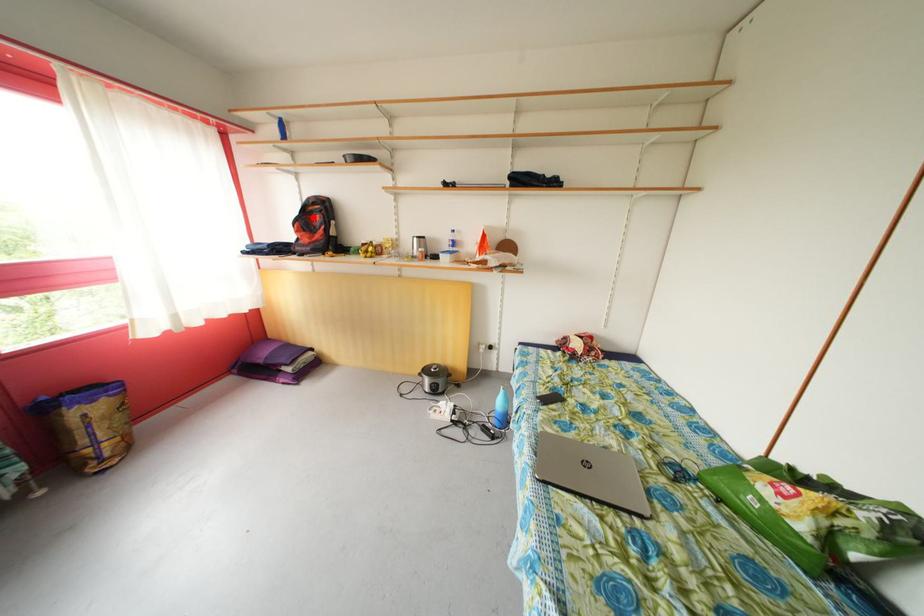
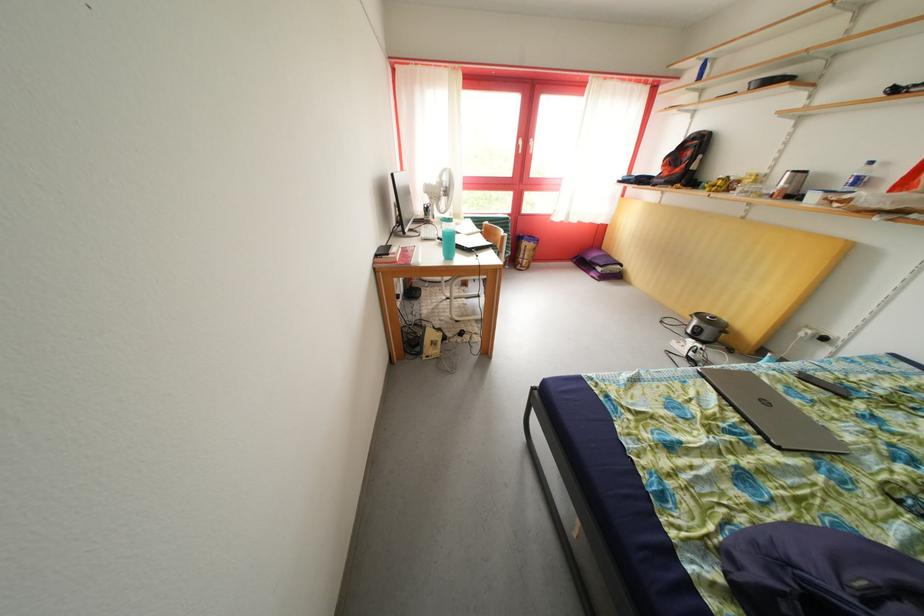
Find the pixel in the second image that matches the highlighted location in the first image.

(689, 153)